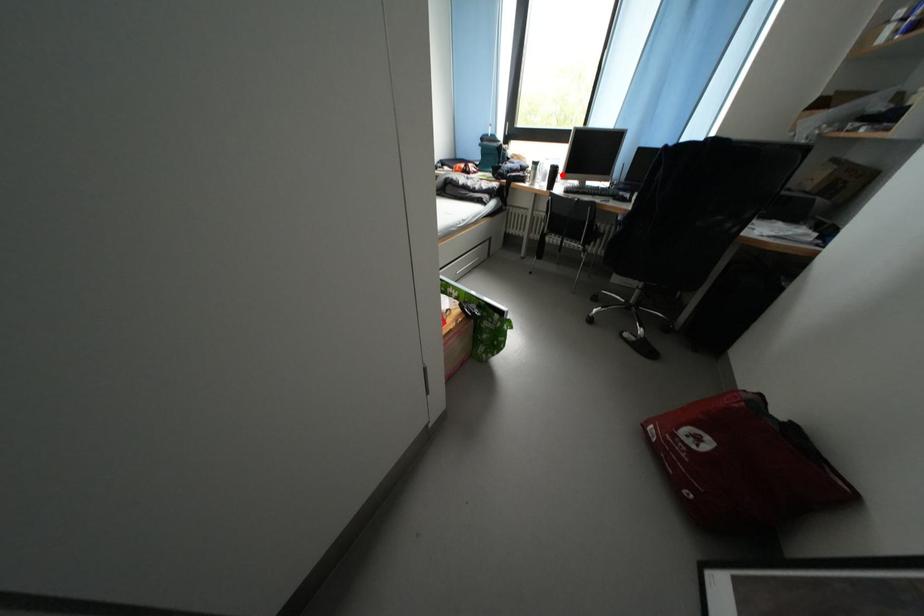
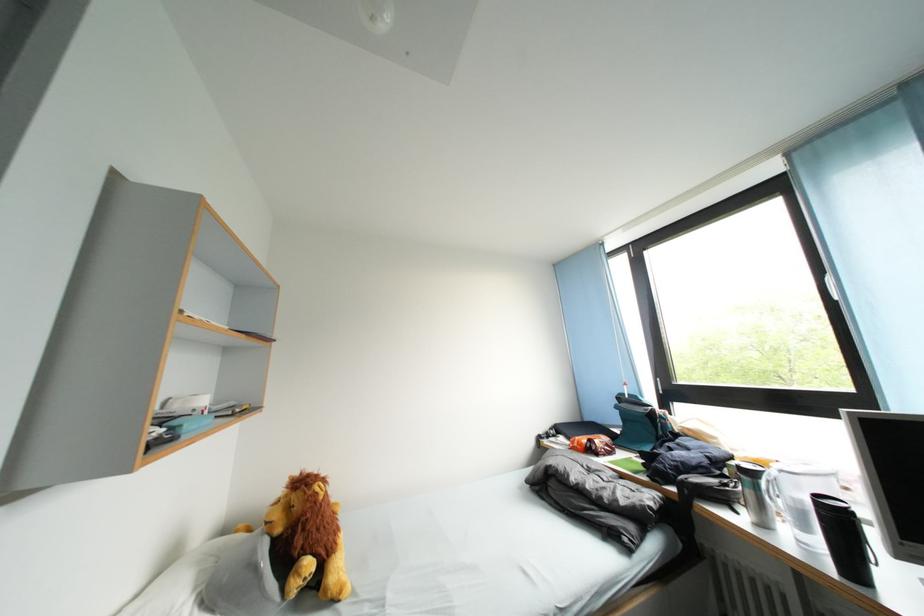
Locate, in the second image, the point that corresponds to the highlighted location in the first image.

(844, 522)